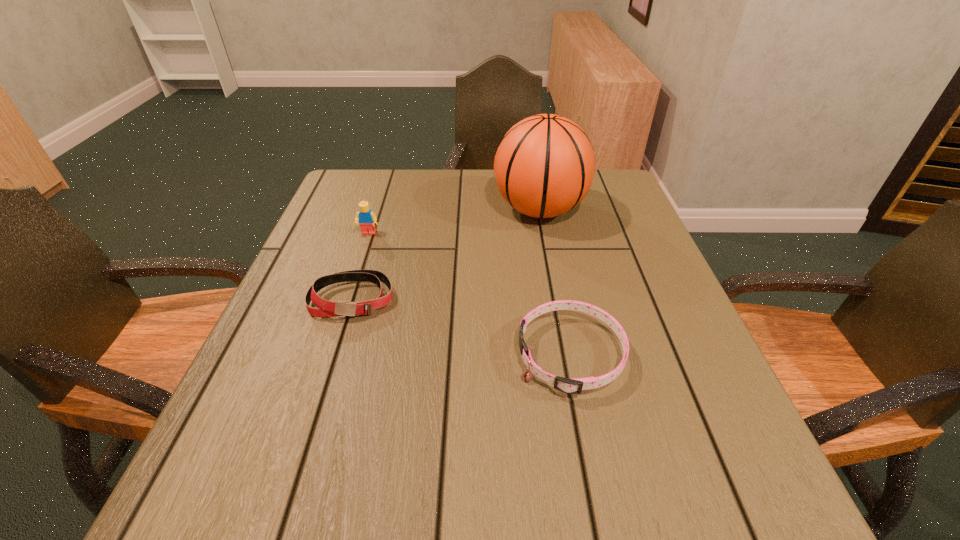
Where is `basketball`? The image size is (960, 540). basketball is located at coordinates (544, 166).

Where is `Lego`? The image size is (960, 540). Lego is located at coordinates (366, 218).

Where is `the left dog collar`? The image size is (960, 540). the left dog collar is located at coordinates (325, 308).

This screenshot has height=540, width=960. Identify the location of the right dog collar. (575, 385).

Locate an element on the screen. This screenshot has width=960, height=540. free space located on the left of the basketball is located at coordinates (417, 210).

Locate an element on the screen. free region located on the front-facing side of the third shortest object is located at coordinates (333, 342).

Find the location of a particular element. vacant space located on the front of the left dog collar is located at coordinates (329, 372).

This screenshot has width=960, height=540. What are the coordinates of `free spot located 0.350m with the buckle on the right dog collar` in the screenshot? It's located at (323, 355).

Find the location of a particular element. Image resolution: width=960 pixels, height=540 pixels. free space located with the buckle on the right dog collar is located at coordinates (445, 355).

The width and height of the screenshot is (960, 540). I want to click on vacant area located with the buckle on the right dog collar, so click(x=479, y=355).